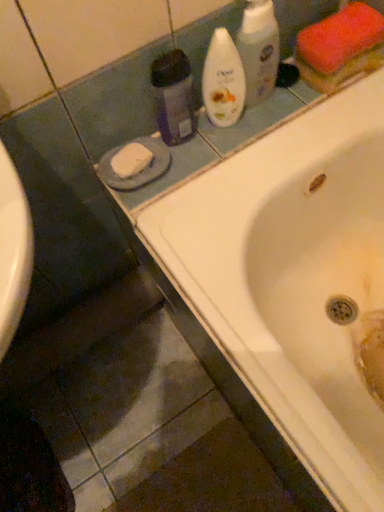
This screenshot has width=384, height=512. Describe the element at coordinates (259, 50) in the screenshot. I see `white glossy bottle at upper center, which appears as the 1th cleaning product when viewed from the right` at that location.

Locate an element on the screen. The height and width of the screenshot is (512, 384). translucent purple bottle at upper center, which is counted as the first cleaning product, starting from the left is located at coordinates pos(173,96).

Locate an element on the screen. white glossy bathtub at upper center is located at coordinates (242, 265).

Could white glossy bathtub at upper center be considered to be inside translucent purple bottle at upper center, which is counted as the first cleaning product, starting from the left?

No, white glossy bathtub at upper center is not inside translucent purple bottle at upper center, which is counted as the first cleaning product, starting from the left.

From a real-world perspective, is translucent purple bottle at upper center, acting as the third cleaning product starting from the right, below white glossy bathtub at upper center?

No, from a real-world perspective, translucent purple bottle at upper center, acting as the third cleaning product starting from the right, is not below white glossy bathtub at upper center.

Considering the relative positions of translucent purple bottle at upper center, which is counted as the first cleaning product, starting from the left, and white glossy bathtub at upper center in the image provided, is translucent purple bottle at upper center, which is counted as the first cleaning product, starting from the left, to the right of white glossy bathtub at upper center from the viewer's perspective?

No, translucent purple bottle at upper center, which is counted as the first cleaning product, starting from the left, is not to the right of white glossy bathtub at upper center.

Which of these two, translucent purple bottle at upper center, which is counted as the first cleaning product, starting from the left, or white glossy bathtub at upper center, is thinner?

Thinner between the two is translucent purple bottle at upper center, which is counted as the first cleaning product, starting from the left.

From the image's perspective, between white glossy bathtub at upper center and white glossy bottle at upper center, marked as the 2th cleaning product in a right-to-left arrangement, who is located below?

white glossy bathtub at upper center appears lower in the image.

Is white glossy bathtub at upper center wider than white glossy bottle at upper center, marked as the 2th cleaning product in a right-to-left arrangement?

Correct, the width of white glossy bathtub at upper center exceeds that of white glossy bottle at upper center, marked as the 2th cleaning product in a right-to-left arrangement.

Considering the points (160, 251) and (220, 127), which point is in front, point (160, 251) or point (220, 127)?

The point (160, 251) is closer to the camera.

From a real-world perspective, is white glossy bottle at upper center, which appears as the 1th cleaning product when viewed from the right, above or below white glossy bathtub at upper center?

Clearly, from a real-world perspective, white glossy bottle at upper center, which appears as the 1th cleaning product when viewed from the right, is above white glossy bathtub at upper center.

Which is in front, point (264, 10) or point (166, 228)?

The point (264, 10) is in front.

Does white glossy bottle at upper center, which appears as the 1th cleaning product when viewed from the right, have a smaller size compared to white glossy bathtub at upper center?

Indeed, white glossy bottle at upper center, which appears as the 1th cleaning product when viewed from the right, has a smaller size compared to white glossy bathtub at upper center.

Between white glossy bottle at upper center, which appears as the 1th cleaning product when viewed from the right, and white glossy bathtub at upper center, which one is positioned in front?

white glossy bathtub at upper center.

From the image's perspective, would you say white glossy bottle at upper center, which ranks as the third cleaning product in left-to-right order, is shown under white glossy bottle at upper center, marked as the 2th cleaning product in a right-to-left arrangement?

Incorrect, from the image's perspective, white glossy bottle at upper center, which ranks as the third cleaning product in left-to-right order, is higher than white glossy bottle at upper center, marked as the 2th cleaning product in a right-to-left arrangement.

Where is `cleaning product that is the 1st one when counting leftward from the white glossy bottle at upper center, which ranks as the third cleaning product in left-to-right order`? The width and height of the screenshot is (384, 512). cleaning product that is the 1st one when counting leftward from the white glossy bottle at upper center, which ranks as the third cleaning product in left-to-right order is located at coordinates (223, 81).

What's the angular difference between white glossy bottle at upper center, which ranks as the third cleaning product in left-to-right order, and white glossy bottle at upper center, which is the 2th cleaning product in left-to-right order,'s facing directions?

6.13e-05 degrees.

Looking at this image, in the image, is white glossy bathtub at upper center on the left side or the right side of white glossy bottle at upper center, which ranks as the third cleaning product in left-to-right order?

Clearly, white glossy bathtub at upper center is on the right of white glossy bottle at upper center, which ranks as the third cleaning product in left-to-right order, in the image.

Does white glossy bathtub at upper center have a greater width compared to white glossy bottle at upper center, which appears as the 1th cleaning product when viewed from the right?

Yes.

Looking at this image, what's the angular difference between white glossy bathtub at upper center and white glossy bottle at upper center, which appears as the 1th cleaning product when viewed from the right,'s facing directions?

90.3 degrees.

Is white glossy bottle at upper center, marked as the 2th cleaning product in a right-to-left arrangement, looking in the opposite direction of white glossy bottle at upper center, which appears as the 1th cleaning product when viewed from the right?

No.

Considering the relative sizes of white glossy bottle at upper center, marked as the 2th cleaning product in a right-to-left arrangement, and white glossy bottle at upper center, which ranks as the third cleaning product in left-to-right order, in the image provided, is white glossy bottle at upper center, marked as the 2th cleaning product in a right-to-left arrangement, thinner than white glossy bottle at upper center, which ranks as the third cleaning product in left-to-right order,?

Incorrect, the width of white glossy bottle at upper center, marked as the 2th cleaning product in a right-to-left arrangement, is not less than that of white glossy bottle at upper center, which ranks as the third cleaning product in left-to-right order.

Is white glossy bottle at upper center, which is the 2th cleaning product in left-to-right order, further to camera compared to white glossy bottle at upper center, which ranks as the third cleaning product in left-to-right order?

No, the depth of white glossy bottle at upper center, which is the 2th cleaning product in left-to-right order, is less than that of white glossy bottle at upper center, which ranks as the third cleaning product in left-to-right order.

Considering the sizes of objects white glossy bottle at upper center, marked as the 2th cleaning product in a right-to-left arrangement, and white glossy bottle at upper center, which appears as the 1th cleaning product when viewed from the right, in the image provided, who is smaller, white glossy bottle at upper center, marked as the 2th cleaning product in a right-to-left arrangement, or white glossy bottle at upper center, which appears as the 1th cleaning product when viewed from the right,?

white glossy bottle at upper center, which appears as the 1th cleaning product when viewed from the right, is smaller.

Is translucent purple bottle at upper center, acting as the third cleaning product starting from the right, inside or outside of white glossy bottle at upper center, which ranks as the third cleaning product in left-to-right order?

translucent purple bottle at upper center, acting as the third cleaning product starting from the right, is outside white glossy bottle at upper center, which ranks as the third cleaning product in left-to-right order.

From a real-world perspective, is translucent purple bottle at upper center, acting as the third cleaning product starting from the right, below white glossy bottle at upper center, which appears as the 1th cleaning product when viewed from the right?

Yes, from a real-world perspective, translucent purple bottle at upper center, acting as the third cleaning product starting from the right, is under white glossy bottle at upper center, which appears as the 1th cleaning product when viewed from the right.

In the image, is translucent purple bottle at upper center, which is counted as the first cleaning product, starting from the left, positioned in front of or behind white glossy bottle at upper center, which appears as the 1th cleaning product when viewed from the right?

translucent purple bottle at upper center, which is counted as the first cleaning product, starting from the left, is positioned closer to the viewer than white glossy bottle at upper center, which appears as the 1th cleaning product when viewed from the right.

Which of these two, translucent purple bottle at upper center, which is counted as the first cleaning product, starting from the left, or white glossy bottle at upper center, which ranks as the third cleaning product in left-to-right order, is smaller?

translucent purple bottle at upper center, which is counted as the first cleaning product, starting from the left, is smaller.

Find the location of a particular element. This screenshot has height=512, width=384. bathtub in front of the translucent purple bottle at upper center, acting as the third cleaning product starting from the right is located at coordinates (242, 265).

At what (x,y) coordinates should I click in order to perform the action: click on bathtub on the right of white glossy bottle at upper center, which is the 2th cleaning product in left-to-right order. Please return your answer as a coordinate pair (x, y). This screenshot has width=384, height=512. Looking at the image, I should click on (242, 265).

Estimate the real-world distances between objects in this image. Which object is closer to white glossy bathtub at upper center, translucent purple bottle at upper center, which is counted as the first cleaning product, starting from the left, or white glossy bottle at upper center, which appears as the 1th cleaning product when viewed from the right?

Among the two, translucent purple bottle at upper center, which is counted as the first cleaning product, starting from the left, is located nearer to white glossy bathtub at upper center.

Estimate the real-world distances between objects in this image. Which object is closer to white glossy bottle at upper center, which is the 2th cleaning product in left-to-right order, white glossy bottle at upper center, which ranks as the third cleaning product in left-to-right order, or translucent purple bottle at upper center, acting as the third cleaning product starting from the right?

Based on the image, white glossy bottle at upper center, which ranks as the third cleaning product in left-to-right order, appears to be nearer to white glossy bottle at upper center, which is the 2th cleaning product in left-to-right order.

Considering their positions, is white glossy bathtub at upper center positioned further to translucent purple bottle at upper center, which is counted as the first cleaning product, starting from the left, than white glossy bottle at upper center, which ranks as the third cleaning product in left-to-right order?

The object further to translucent purple bottle at upper center, which is counted as the first cleaning product, starting from the left, is white glossy bathtub at upper center.

From the image, which object appears to be nearer to translucent purple bottle at upper center, which is counted as the first cleaning product, starting from the left, white glossy bottle at upper center, which is the 2th cleaning product in left-to-right order, or white glossy bathtub at upper center?

The object closer to translucent purple bottle at upper center, which is counted as the first cleaning product, starting from the left, is white glossy bottle at upper center, which is the 2th cleaning product in left-to-right order.

From the image, which object appears to be farther from translucent purple bottle at upper center, acting as the third cleaning product starting from the right, white glossy bottle at upper center, marked as the 2th cleaning product in a right-to-left arrangement, or white glossy bottle at upper center, which ranks as the third cleaning product in left-to-right order?

Among the two, white glossy bottle at upper center, which ranks as the third cleaning product in left-to-right order, is located further to translucent purple bottle at upper center, acting as the third cleaning product starting from the right.

When comparing their distances from white glossy bottle at upper center, which appears as the 1th cleaning product when viewed from the right, does white glossy bottle at upper center, which is the 2th cleaning product in left-to-right order, or white glossy bathtub at upper center seem closer?

white glossy bottle at upper center, which is the 2th cleaning product in left-to-right order, is closer to white glossy bottle at upper center, which appears as the 1th cleaning product when viewed from the right.

Estimate the real-world distances between objects in this image. Which object is further from translucent purple bottle at upper center, which is counted as the first cleaning product, starting from the left, white glossy bottle at upper center, which appears as the 1th cleaning product when viewed from the right, or white glossy bottle at upper center, which is the 2th cleaning product in left-to-right order?

white glossy bottle at upper center, which appears as the 1th cleaning product when viewed from the right, is further to translucent purple bottle at upper center, which is counted as the first cleaning product, starting from the left.

Considering their positions, is translucent purple bottle at upper center, which is counted as the first cleaning product, starting from the left, positioned further to white glossy bottle at upper center, which ranks as the third cleaning product in left-to-right order, than white glossy bathtub at upper center?

white glossy bathtub at upper center lies further to white glossy bottle at upper center, which ranks as the third cleaning product in left-to-right order, than the other object.

In order to click on cleaning product located between translucent purple bottle at upper center, which is counted as the first cleaning product, starting from the left, and white glossy bottle at upper center, which appears as the 1th cleaning product when viewed from the right, in the left-right direction in this screenshot , I will do `click(223, 81)`.

In order to click on cleaning product that lies between white glossy bottle at upper center, which is the 2th cleaning product in left-to-right order, and white glossy bathtub at upper center from top to bottom in this screenshot , I will do `click(173, 96)`.